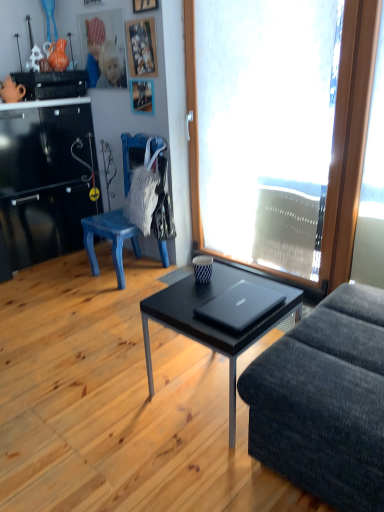
Measure the distance between wooden picture frame at upper center, acting as the first picture frame starting from the bottom, and camera.

A distance of 2.94 meters exists between wooden picture frame at upper center, acting as the first picture frame starting from the bottom, and camera.

The width and height of the screenshot is (384, 512). What do you see at coordinates (110, 239) in the screenshot?
I see `blue painted wood chair at left` at bounding box center [110, 239].

Identify the location of transparent glass window at center. (262, 131).

Does point (124, 281) appear closer or farther from the camera than point (226, 329)?

Point (124, 281).

Does blue painted wood chair at left turn towards black matte laptop at center?

No, blue painted wood chair at left is not turned towards black matte laptop at center.

Which of these two, blue painted wood chair at left or black matte laptop at center, is smaller?

black matte laptop at center.

Can you confirm if transparent glass window at center is shorter than black matte coffee table at center?

Incorrect, the height of transparent glass window at center does not fall short of that of black matte coffee table at center.

Would you say transparent glass window at center is inside or outside black matte coffee table at center?

transparent glass window at center is located beyond the bounds of black matte coffee table at center.

From the image's perspective, between transparent glass window at center and black matte coffee table at center, which one is located above?

From the image's view, transparent glass window at center is above.

Between wooden picture frame at upper center, marked as the 3th picture frame in a top-to-bottom arrangement, and wooden picture frame at upper center, which ranks as the 2th picture frame in bottom-to-top order, which one appears on the left side from the viewer's perspective?

From the viewer's perspective, wooden picture frame at upper center, marked as the 3th picture frame in a top-to-bottom arrangement, appears more on the left side.

Considering the positions of objects wooden picture frame at upper center, marked as the 3th picture frame in a top-to-bottom arrangement, and wooden picture frame at upper center, which ranks as the 2th picture frame in bottom-to-top order, in the image provided, who is in front, wooden picture frame at upper center, marked as the 3th picture frame in a top-to-bottom arrangement, or wooden picture frame at upper center, which ranks as the 2th picture frame in bottom-to-top order,?

wooden picture frame at upper center, which ranks as the 2th picture frame in bottom-to-top order, is closer to the camera.

Is point (133, 108) positioned in front of point (146, 52)?

No, (133, 108) is behind (146, 52).

Is wooden picture frame at upper center, acting as the first picture frame starting from the bottom, taller than wooden picture frame at upper center, which ranks as the 2th picture frame in bottom-to-top order?

No.

Do you think wooden picture frame at upper center, the second picture frame in the top-to-bottom sequence, is within transparent glass window at center, or outside of it?

wooden picture frame at upper center, the second picture frame in the top-to-bottom sequence, is not enclosed by transparent glass window at center.

The image size is (384, 512). What are the coordinates of `window located in front of the wooden picture frame at upper center, which ranks as the 2th picture frame in bottom-to-top order` in the screenshot? It's located at (262, 131).

From a real-world perspective, which object rests below the other?

transparent glass window at center.

Considering the sizes of objects wooden picture frame at upper center, the second picture frame in the top-to-bottom sequence, and transparent glass window at center in the image provided, who is smaller, wooden picture frame at upper center, the second picture frame in the top-to-bottom sequence, or transparent glass window at center?

Smaller between the two is wooden picture frame at upper center, the second picture frame in the top-to-bottom sequence.

Based on the photo, is black matte coffee table at center far from wooden picture frame at upper center, acting as the first picture frame starting from the top?

Indeed, black matte coffee table at center is not near wooden picture frame at upper center, acting as the first picture frame starting from the top.

Considering the points (187, 290) and (142, 1), which point is behind, point (187, 290) or point (142, 1)?

The point (142, 1) is behind.

Which of these two, black matte coffee table at center or wooden picture frame at upper center, acting as the first picture frame starting from the top, is wider?

Wider between the two is black matte coffee table at center.

Is wooden picture frame at upper center, acting as the first picture frame starting from the top, a part of black matte coffee table at center?

Actually, wooden picture frame at upper center, acting as the first picture frame starting from the top, is outside black matte coffee table at center.

Is wooden picture frame at upper center, acting as the first picture frame starting from the top, at the right side of wooden picture frame at upper center, the second picture frame in the top-to-bottom sequence?

Yes, wooden picture frame at upper center, acting as the first picture frame starting from the top, is to the right of wooden picture frame at upper center, the second picture frame in the top-to-bottom sequence.

Considering the relative sizes of wooden picture frame at upper center, the 3th picture frame positioned from the bottom, and wooden picture frame at upper center, which ranks as the 2th picture frame in bottom-to-top order, in the image provided, is wooden picture frame at upper center, the 3th picture frame positioned from the bottom, taller than wooden picture frame at upper center, which ranks as the 2th picture frame in bottom-to-top order,?

In fact, wooden picture frame at upper center, the 3th picture frame positioned from the bottom, may be shorter than wooden picture frame at upper center, which ranks as the 2th picture frame in bottom-to-top order.

Looking at their sizes, would you say wooden picture frame at upper center, the 3th picture frame positioned from the bottom, is wider or thinner than wooden picture frame at upper center, the second picture frame in the top-to-bottom sequence?

Considering their sizes, wooden picture frame at upper center, the 3th picture frame positioned from the bottom, looks broader than wooden picture frame at upper center, the second picture frame in the top-to-bottom sequence.

Looking at this image, does wooden picture frame at upper center, the 3th picture frame positioned from the bottom, turn towards wooden picture frame at upper center, which ranks as the 2th picture frame in bottom-to-top order?

No, wooden picture frame at upper center, the 3th picture frame positioned from the bottom, is not turned towards wooden picture frame at upper center, which ranks as the 2th picture frame in bottom-to-top order.

From the image's perspective, which is below, wooden picture frame at upper center, acting as the first picture frame starting from the top, or blue and white ceramic cup at center?

blue and white ceramic cup at center, from the image's perspective.

Who is taller, wooden picture frame at upper center, acting as the first picture frame starting from the top, or blue and white ceramic cup at center?

With more height is wooden picture frame at upper center, acting as the first picture frame starting from the top.

Between point (142, 7) and point (203, 265), which one is positioned behind?

The point (142, 7) is behind.

Does wooden picture frame at upper center, acting as the first picture frame starting from the top, have a larger size compared to blue and white ceramic cup at center?

Yes.

Locate an element on the screen. The width and height of the screenshot is (384, 512). laptop located above the blue painted wood chair at left (from a real-world perspective) is located at coordinates (240, 306).

Locate an element on the screen. coffee table below the transparent glass window at center (from the image's perspective) is located at coordinates (213, 325).

Considering their positions, is black matte coffee table at center positioned further to black matte laptop at center than wooden picture frame at upper center, marked as the 3th picture frame in a top-to-bottom arrangement?

wooden picture frame at upper center, marked as the 3th picture frame in a top-to-bottom arrangement, lies further to black matte laptop at center than the other object.

From the image, which object appears to be farther from transparent glass window at center, blue and white ceramic cup at center or blue painted wood chair at left?

blue and white ceramic cup at center.

From the picture: Estimate the real-world distances between objects in this image. Which object is further from wooden picture frame at upper center, acting as the first picture frame starting from the top, black matte laptop at center or blue painted wood chair at left?

black matte laptop at center is positioned further to the anchor wooden picture frame at upper center, acting as the first picture frame starting from the top.

From the image, which object appears to be nearer to wooden picture frame at upper center, the second picture frame in the top-to-bottom sequence, blue painted wood chair at left or wooden picture frame at upper center, the 3th picture frame positioned from the bottom?

The object closer to wooden picture frame at upper center, the second picture frame in the top-to-bottom sequence, is wooden picture frame at upper center, the 3th picture frame positioned from the bottom.

Based on their spatial positions, is black matte coffee table at center or wooden picture frame at upper center, acting as the first picture frame starting from the top, further from blue painted wood chair at left?

black matte coffee table at center lies further to blue painted wood chair at left than the other object.

Estimate the real-world distances between objects in this image. Which object is closer to wooden picture frame at upper center, marked as the 3th picture frame in a top-to-bottom arrangement, blue painted wood chair at left or blue and white ceramic cup at center?

blue painted wood chair at left is positioned closer to the anchor wooden picture frame at upper center, marked as the 3th picture frame in a top-to-bottom arrangement.

Looking at the image, which one is located further to wooden picture frame at upper center, marked as the 3th picture frame in a top-to-bottom arrangement, blue painted wood chair at left or black matte coffee table at center?

black matte coffee table at center is positioned further to the anchor wooden picture frame at upper center, marked as the 3th picture frame in a top-to-bottom arrangement.

From the image, which object appears to be farther from black matte coffee table at center, transparent glass window at center or black plastic stereo at upper left?

black plastic stereo at upper left is positioned further to the anchor black matte coffee table at center.

This screenshot has height=512, width=384. I want to click on chair between wooden picture frame at upper center, which ranks as the 2th picture frame in bottom-to-top order, and blue and white ceramic cup at center vertically, so click(x=110, y=239).

Identify the location of chair that lies between wooden picture frame at upper center, acting as the first picture frame starting from the top, and black matte laptop at center from top to bottom. The width and height of the screenshot is (384, 512). (110, 239).

You are a GUI agent. You are given a task and a screenshot of the screen. Output one action in this format:
    pyautogui.click(x=<x>, y=<y>)
    Task: Click on the picture frame that lies between black plastic stereo at upper left and blue painted wood chair at left from top to bottom
    
    Given the screenshot: What is the action you would take?
    pyautogui.click(x=142, y=96)

Where is `coffee cup between blue painted wood chair at left and transparent glass window at center in the horizontal direction`? Image resolution: width=384 pixels, height=512 pixels. coffee cup between blue painted wood chair at left and transparent glass window at center in the horizontal direction is located at coordinates (x=202, y=268).